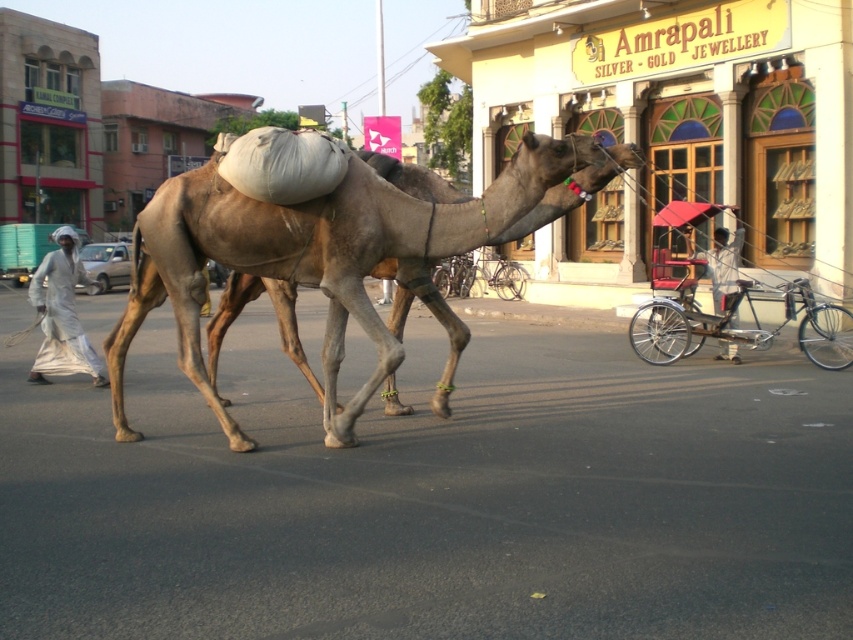
Between white cotton clothing at left and white fabric cart at center, which one is positioned higher?

white fabric cart at center

Is white cotton clothing at left above white fabric cart at center?

Actually, white cotton clothing at left is below white fabric cart at center.

Which is in front, point (61, 360) or point (718, 241)?

Point (61, 360) is more forward.

Where is `white cotton clothing at left`? white cotton clothing at left is located at coordinates (62, 314).

Does brown matte camel at center appear on the right side of metallic silver rickshaw at right?

No, brown matte camel at center is not to the right of metallic silver rickshaw at right.

From the picture: Between brown matte camel at center and metallic silver rickshaw at right, which one is positioned lower?

metallic silver rickshaw at right is below.

Image resolution: width=853 pixels, height=640 pixels. Describe the element at coordinates (335, 257) in the screenshot. I see `brown matte camel at center` at that location.

Locate an element on the screen. This screenshot has height=640, width=853. brown matte camel at center is located at coordinates (335, 257).

Consider the image. Which is above, brown matte camel at center or white cotton clothing at left?

white cotton clothing at left is above.

Can you confirm if brown matte camel at center is positioned to the right of white cotton clothing at left?

Correct, you'll find brown matte camel at center to the right of white cotton clothing at left.

This screenshot has height=640, width=853. Identify the location of brown matte camel at center. (335, 257).